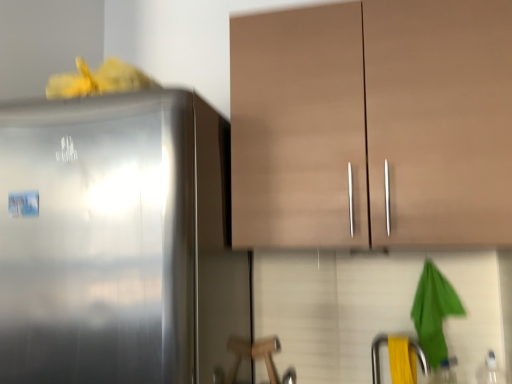
Question: From their relative heights in the image, would you say yellow rubber at lower right is taller or shorter than matte brown cabinet at upper center?

Choices:
 (A) tall
 (B) short

Answer: (B)

Question: From the image's perspective, relative to matte brown cabinet at upper center, is yellow rubber at lower right above or below?

Choices:
 (A) below
 (B) above

Answer: (A)

Question: Which object is the farthest from the satin silver refrigerator at left?

Choices:
 (A) yellow rubber at lower right
 (B) matte brown cabinet at upper center

Answer: (A)

Question: Estimate the real-world distances between objects in this image. Which object is closer to the satin silver refrigerator at left?

Choices:
 (A) matte brown cabinet at upper center
 (B) yellow rubber at lower right

Answer: (A)